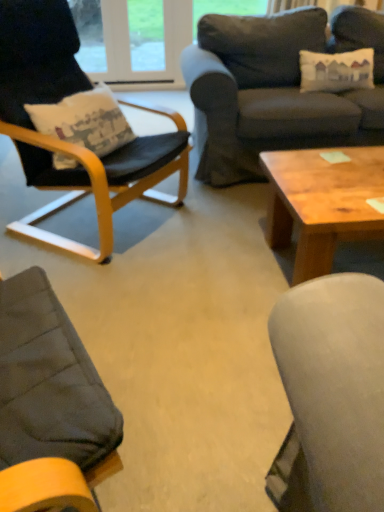
Question: Is dark gray fabric couch at upper right far away from wooden coffee table at center?

Choices:
 (A) yes
 (B) no

Answer: (B)

Question: From the image's perspective, is dark gray fabric couch at upper right below wooden coffee table at center?

Choices:
 (A) no
 (B) yes

Answer: (A)

Question: Considering the relative sizes of dark gray fabric couch at upper right and wooden coffee table at center in the image provided, is dark gray fabric couch at upper right smaller than wooden coffee table at center?

Choices:
 (A) yes
 (B) no

Answer: (B)

Question: Is dark gray fabric couch at upper right behind wooden coffee table at center?

Choices:
 (A) yes
 (B) no

Answer: (A)

Question: Considering the relative sizes of dark gray fabric couch at upper right and wooden coffee table at center in the image provided, is dark gray fabric couch at upper right bigger than wooden coffee table at center?

Choices:
 (A) yes
 (B) no

Answer: (A)

Question: Is dark gray fabric couch at upper right oriented away from wooden coffee table at center?

Choices:
 (A) yes
 (B) no

Answer: (B)

Question: Is wooden coffee table at center beside black leather chair at left?

Choices:
 (A) yes
 (B) no

Answer: (B)

Question: From a real-world perspective, is wooden coffee table at center located beneath black leather chair at left?

Choices:
 (A) yes
 (B) no

Answer: (A)

Question: From the image's perspective, is wooden coffee table at center located above black leather chair at left?

Choices:
 (A) yes
 (B) no

Answer: (B)

Question: Considering the relative positions of wooden coffee table at center and black leather chair at left in the image provided, is wooden coffee table at center to the left of black leather chair at left from the viewer's perspective?

Choices:
 (A) no
 (B) yes

Answer: (A)

Question: Is wooden coffee table at center facing away from black leather chair at left?

Choices:
 (A) no
 (B) yes

Answer: (A)

Question: Can you confirm if wooden coffee table at center is taller than black leather chair at left?

Choices:
 (A) no
 (B) yes

Answer: (A)

Question: Is black leather chair at left bigger than dark gray fabric couch at upper right?

Choices:
 (A) no
 (B) yes

Answer: (A)